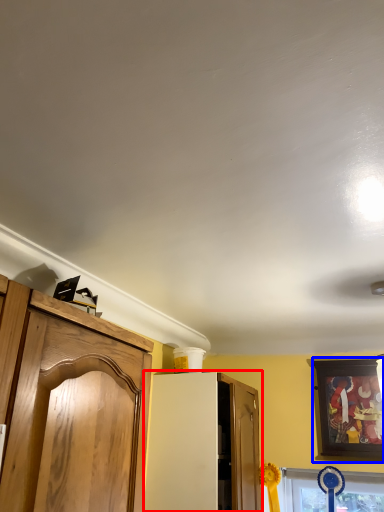
Question: Which point is further to the camera, cabinetry (highlighted by a red box) or picture frame (highlighted by a blue box)?

Choices:
 (A) cabinetry
 (B) picture frame

Answer: (B)